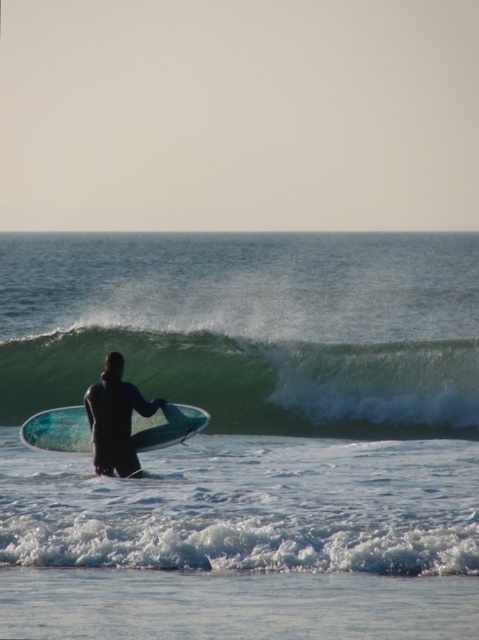
You are a photographer on the beach and want to capture the black wetsuit surfer at center and the translucent blue surfboard at center in a single shot. Which object should you position closer to the left side of your camera frame to ensure both are fully visible?

You should position the black wetsuit surfer at center closer to the left side of your camera frame because the translucent blue surfboard at center is to the right of it, ensuring both are fully visible in the shot.

You are a surfer preparing to ride a wave. You see the translucent blue water at center and the green rubber wave at center. Which object is located to the left of the other?

The translucent blue water at center is positioned on the left side of green rubber wave at center.

Consider the image. You are a photographer trying to capture the surfer and their translucent blue surfboard at center in the image. To ensure the surfboard is centered in your shot, where should you aim your camera? Please provide the coordinates as a point in the format of a tuple with two decimal numbers, like this example format. The coordinates should be between 0 and 1, where 0 is the bottom left corner and 1 is the top right corner of the image.

The translucent blue surfboard at center is located at point coordinates of (58, 429). To center it in your shot, aim your camera at the coordinates point of approximately (58, 429).